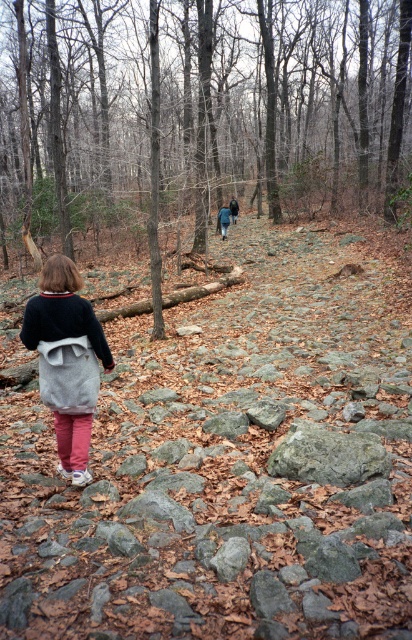
You are standing at the starting point of the forest path. You want to walk along the brown rocky trail at center. According to the map, the coordinates of the trail are at point 0.173, 0.483. Can you confirm if the trail is directly in front of you?

The brown rocky trail at center is located at coordinates (198, 109), which indicates it is directly in front of you.

You are a hiker trying to place your gray fabric backpack at center on the ground next to the rough textured rocks at center. Based on the scene, can you safely place the backpack there without it being on the rocks?

The rough textured rocks at center are positioned on the right side of the gray fabric backpack at center, so placing the backpack to the left of the rocks would keep it off the rocks.